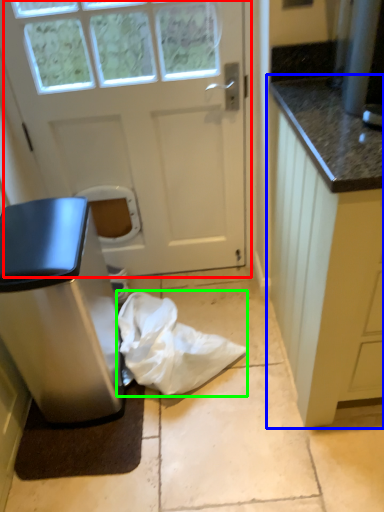
Question: Which object is the closest to the door (highlighted by a red box)? Choose among these: cabinetry (highlighted by a blue box) or material (highlighted by a green box).

Choices:
 (A) cabinetry
 (B) material

Answer: (B)